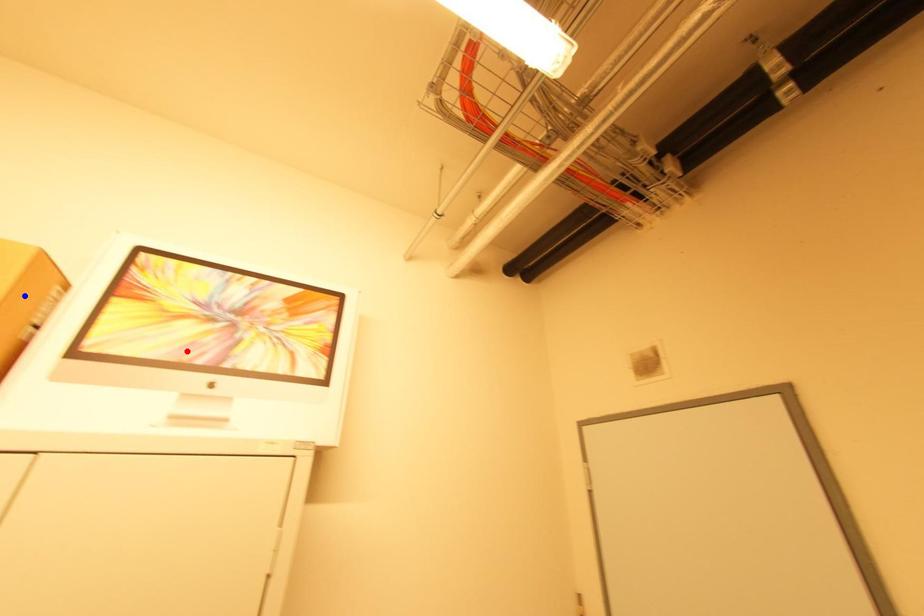
Question: Which of the two points in the image is closer to the camera?

Choices:
 (A) Blue point is closer.
 (B) Red point is closer.

Answer: (A)